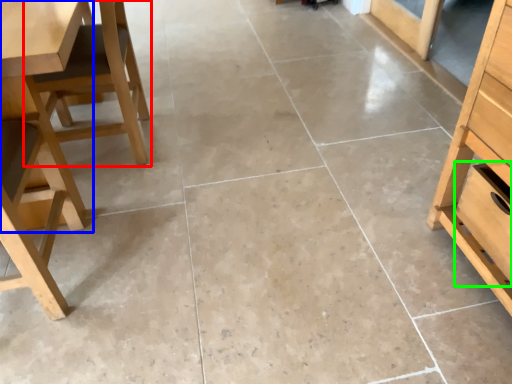
Question: Which is nearer to the chair (highlighted by a red box)? table (highlighted by a blue box) or drawer (highlighted by a green box).

Choices:
 (A) table
 (B) drawer

Answer: (A)